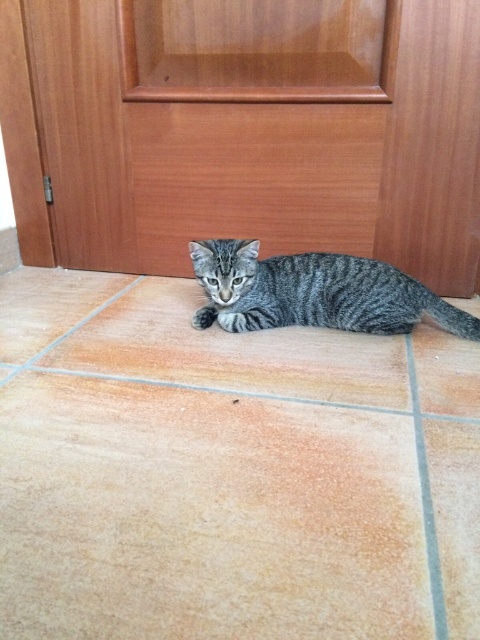
Measure the distance between wooden door at center and gray striped cat at center.

A distance of 15.09 inches exists between wooden door at center and gray striped cat at center.

Is wooden door at center in front of gray striped cat at center?

That is True.

Image resolution: width=480 pixels, height=640 pixels. I want to click on wooden door at center, so [108, 134].

Who is positioned more to the left, brown tile at center or gray striped cat at center?

brown tile at center is more to the left.

Does brown tile at center have a lesser height compared to gray striped cat at center?

Incorrect, brown tile at center's height does not fall short of gray striped cat at center's.

Which is behind, point (334, 396) or point (207, 289)?

Point (207, 289)

Locate an element on the screen. Image resolution: width=480 pixels, height=640 pixels. brown tile at center is located at coordinates (228, 352).

Is wooden door at center shorter than brown tile at center?

No.

Who is positioned more to the left, wooden door at center or brown tile at center?

Positioned to the left is brown tile at center.

Between point (124, 19) and point (404, 403), which one is positioned behind?

The point (124, 19) is behind.

Where is `wooden door at center`? Image resolution: width=480 pixels, height=640 pixels. wooden door at center is located at coordinates (108, 134).